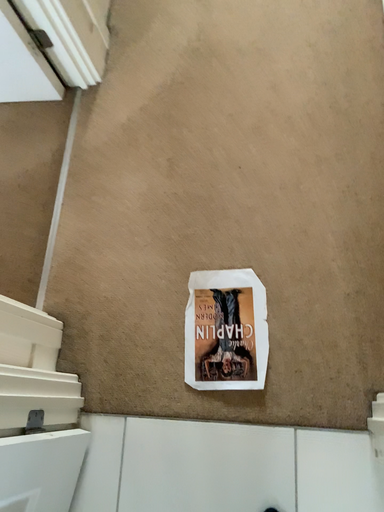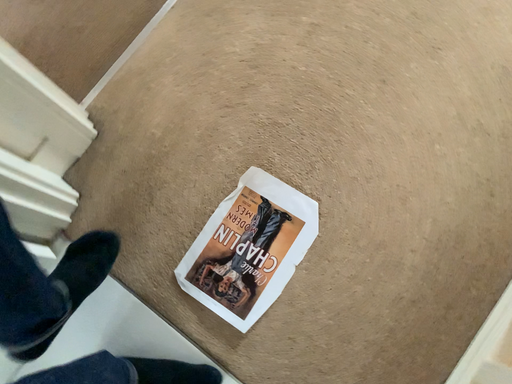
Question: How did the camera likely rotate when shooting the video?

Choices:
 (A) rotated right
 (B) rotated left

Answer: (B)